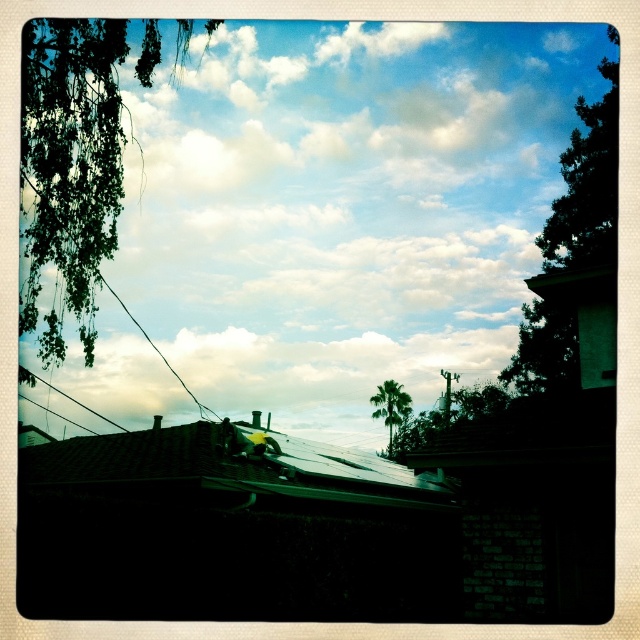
From the picture: Between green leafy branches at upper left and green leafy tree at upper right, which one has less height?

green leafy tree at upper right

Looking at this image, between green leafy branches at upper left and green leafy tree at upper right, which one has more height?

green leafy branches at upper left is taller.

The image size is (640, 640). Identify the location of green leafy branches at upper left. point(70,168).

Is green tile roof at lower left closer to camera compared to green leafy tree at upper right?

Yes, it is.

What do you see at coordinates (221, 468) in the screenshot? This screenshot has height=640, width=640. I see `green tile roof at lower left` at bounding box center [221, 468].

Identify the location of green tile roof at lower left. (221, 468).

Does green leafy branches at upper left appear over green tile roof at lower left?

Yes.

Which is in front, point (81, 205) or point (156, 436)?

Point (81, 205)

This screenshot has height=640, width=640. What do you see at coordinates (70, 168) in the screenshot?
I see `green leafy branches at upper left` at bounding box center [70, 168].

Find the location of a particular element. This screenshot has height=640, width=640. green leafy branches at upper left is located at coordinates (70, 168).